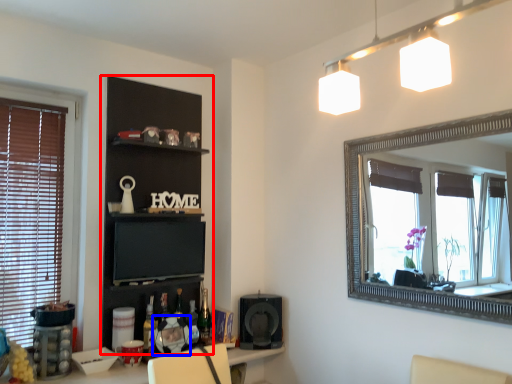
Question: Which of the following is the farthest to the observer, shelf (highlighted by a red box) or picture frame (highlighted by a blue box)?

Choices:
 (A) shelf
 (B) picture frame

Answer: (B)